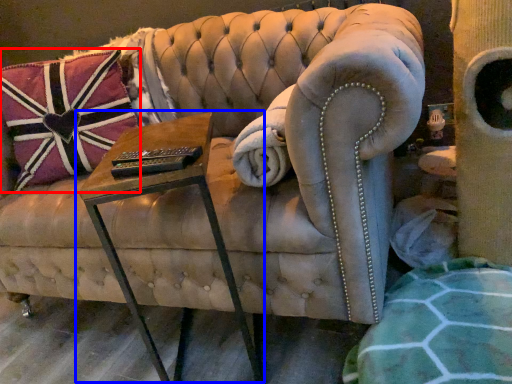
Question: Which point is further to the camera, pillow (highlighted by a red box) or table (highlighted by a blue box)?

Choices:
 (A) pillow
 (B) table

Answer: (A)